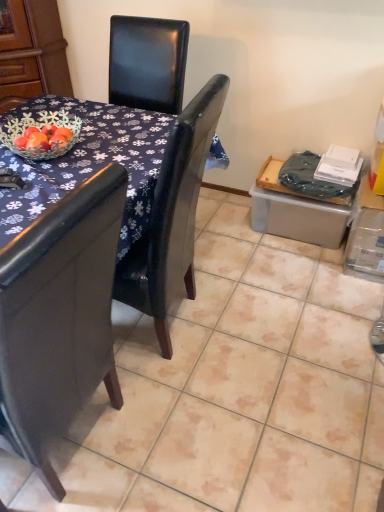
Question: Considering the relative positions of glossy dark wood table at center and brushed wood armoire at upper left in the image provided, is glossy dark wood table at center to the left or to the right of brushed wood armoire at upper left?

Choices:
 (A) left
 (B) right

Answer: (B)

Question: Is glossy dark wood table at center spatially inside brushed wood armoire at upper left, or outside of it?

Choices:
 (A) outside
 (B) inside

Answer: (A)

Question: Considering the real-world distances, which object is farthest from the brushed wood armoire at upper left?

Choices:
 (A) glossy dark wood table at center
 (B) black leather chair at upper center

Answer: (B)

Question: Which object is positioned closest to the glossy dark wood table at center?

Choices:
 (A) black leather chair at upper center
 (B) brushed wood armoire at upper left

Answer: (A)